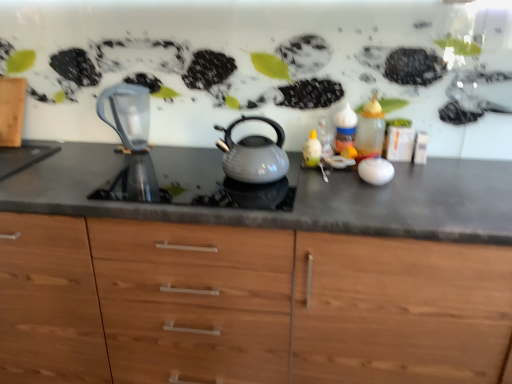
Find the location of a particular element. The height and width of the screenshot is (384, 512). transparent glass jug at left is located at coordinates (128, 114).

The height and width of the screenshot is (384, 512). Identify the location of matte gray kettle at center. (254, 154).

Locate an element on the screen. translucent glass bottle at right is located at coordinates (370, 130).

Based on the photo, is matte gray countertop at center not inside matte gray kettle at center?

Yes.

Can you confirm if matte gray countertop at center is thinner than matte gray kettle at center?

In fact, matte gray countertop at center might be wider than matte gray kettle at center.

Is matte gray countertop at center looking in the opposite direction of matte gray kettle at center?

That's not correct — matte gray countertop at center is not looking away from matte gray kettle at center.

Looking at the image, does matte gray countertop at center seem bigger or smaller compared to matte gray kettle at center?

In the image, matte gray countertop at center appears to be larger than matte gray kettle at center.

Considering the relative sizes of translucent glass bottle at right and matte gray countertop at center in the image provided, is translucent glass bottle at right wider than matte gray countertop at center?

In fact, translucent glass bottle at right might be narrower than matte gray countertop at center.

Is translucent glass bottle at right far away from matte gray countertop at center?

That's not correct — translucent glass bottle at right is a little close to matte gray countertop at center.

Consider the image. Does translucent glass bottle at right contain matte gray countertop at center?

That's incorrect, matte gray countertop at center is not inside translucent glass bottle at right.

Considering the relative sizes of translucent glass bottle at right and matte gray countertop at center in the image provided, is translucent glass bottle at right taller than matte gray countertop at center?

No, translucent glass bottle at right is not taller than matte gray countertop at center.

Considering the positions of objects transparent glass jug at left and matte gray kettle at center in the image provided, who is more to the right, transparent glass jug at left or matte gray kettle at center?

Positioned to the right is matte gray kettle at center.

From a real-world perspective, does transparent glass jug at left stand above matte gray kettle at center?

Indeed, from a real-world perspective, transparent glass jug at left stands above matte gray kettle at center.

Can you confirm if transparent glass jug at left is wider than matte gray kettle at center?

No, transparent glass jug at left is not wider than matte gray kettle at center.

From the image's perspective, is transparent glass jug at left located above or below matte gray kettle at center?

Based on their image positions, transparent glass jug at left is located above matte gray kettle at center.

From a real-world perspective, is matte gray kettle at center over translucent glass bottle at right?

No, from a real-world perspective, matte gray kettle at center is not above translucent glass bottle at right.

Is matte gray kettle at center positioned before translucent glass bottle at right?

Yes, the depth of matte gray kettle at center is less than that of translucent glass bottle at right.

Looking at this image, is matte gray kettle at center oriented away from translucent glass bottle at right?

No.

From the picture: Considering their positions, is matte gray countertop at center located in front of or behind translucent glass bottle at right?

Clearly, matte gray countertop at center is in front of translucent glass bottle at right.

From the image's perspective, would you say matte gray countertop at center is shown under translucent glass bottle at right?

Yes, from the image's perspective, matte gray countertop at center is beneath translucent glass bottle at right.

Is matte gray countertop at center to the right of translucent glass bottle at right from the viewer's perspective?

Incorrect, matte gray countertop at center is not on the right side of translucent glass bottle at right.

Does point (282, 269) come in front of point (377, 102)?

Yes, it is in front of point (377, 102).

From the image's perspective, which is above, matte gray kettle at center or matte gray countertop at center?

matte gray kettle at center is shown above in the image.

Is matte gray kettle at center thinner than matte gray countertop at center?

Correct, the width of matte gray kettle at center is less than that of matte gray countertop at center.

From the picture: From a real-world perspective, is matte gray kettle at center below matte gray countertop at center?

No, from a real-world perspective, matte gray kettle at center is not beneath matte gray countertop at center.

From the image's perspective, who appears lower, translucent glass bottle at right or transparent glass jug at left?

translucent glass bottle at right, from the image's perspective.

Locate an element on the screen. jug below the translucent glass bottle at right (from a real-world perspective) is located at coordinates (128, 114).

Consider the image. Between translucent glass bottle at right and transparent glass jug at left, which one has more height?

With more height is transparent glass jug at left.

Does point (360, 158) come closer to viewer compared to point (139, 91)?

Yes, it is.

Locate an element on the screen. kettle on the right of matte gray countertop at center is located at coordinates (254, 154).

Image resolution: width=512 pixels, height=384 pixels. In order to click on bottle above the matte gray countertop at center (from the image's perspective) in this screenshot , I will do `click(370, 130)`.

Looking at the image, which one is located closer to translucent glass bottle at right, matte gray countertop at center or transparent glass jug at left?

matte gray countertop at center is closer to translucent glass bottle at right.

In the scene shown: Considering their positions, is transparent glass jug at left positioned further to matte gray kettle at center than matte gray countertop at center?

matte gray countertop at center is positioned further to the anchor matte gray kettle at center.

Estimate the real-world distances between objects in this image. Which object is closer to transparent glass jug at left, matte gray kettle at center or matte gray countertop at center?

matte gray kettle at center.

From the image, which object appears to be farther from translucent glass bottle at right, matte gray countertop at center or matte gray kettle at center?

matte gray countertop at center.

From the image, which object appears to be nearer to transparent glass jug at left, matte gray countertop at center or matte gray kettle at center?

matte gray kettle at center is closer to transparent glass jug at left.

Considering their positions, is matte gray kettle at center positioned further to matte gray countertop at center than transparent glass jug at left?

Based on the image, transparent glass jug at left appears to be further to matte gray countertop at center.

Which object lies further to the anchor point transparent glass jug at left, translucent glass bottle at right or matte gray countertop at center?

translucent glass bottle at right is positioned further to the anchor transparent glass jug at left.

When comparing their distances from matte gray countertop at center, does transparent glass jug at left or translucent glass bottle at right seem further?

The object further to matte gray countertop at center is transparent glass jug at left.

Locate an element on the screen. Image resolution: width=512 pixels, height=384 pixels. cabinetry between transparent glass jug at left and translucent glass bottle at right from left to right is located at coordinates (244, 305).

You are a GUI agent. You are given a task and a screenshot of the screen. Output one action in this format:
    pyautogui.click(x=<x>, y=<y>)
    Task: Click on the kettle that lies between translucent glass bottle at right and matte gray countertop at center from top to bottom
    The height and width of the screenshot is (384, 512).
    Given the screenshot: What is the action you would take?
    pyautogui.click(x=254, y=154)

At what (x,y) coordinates should I click in order to perform the action: click on kettle between transparent glass jug at left and matte gray countertop at center in the up-down direction. Please return your answer as a coordinate pair (x, y). The height and width of the screenshot is (384, 512). Looking at the image, I should click on (254, 154).

In order to click on kettle situated between transparent glass jug at left and translucent glass bottle at right from left to right in this screenshot , I will do `click(254, 154)`.